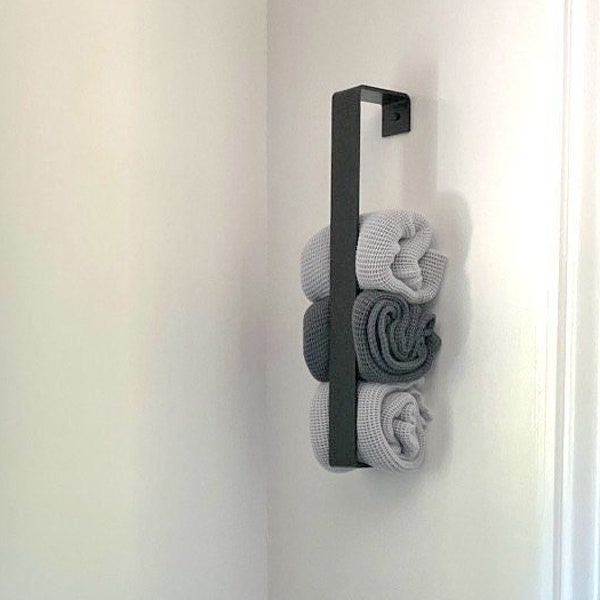
Image resolution: width=600 pixels, height=600 pixels. In order to click on towel in this screenshot , I will do `click(379, 240)`, `click(370, 300)`, `click(371, 419)`.